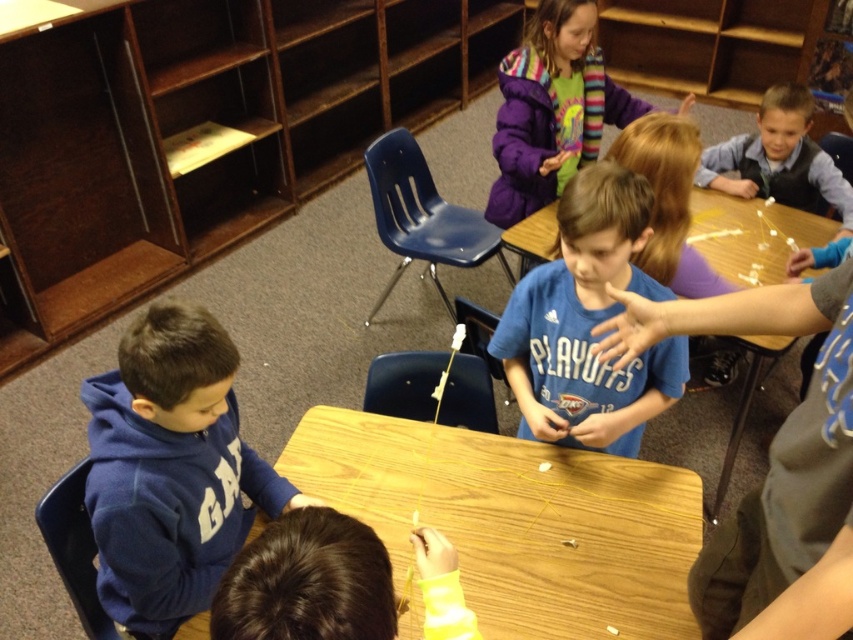
You are a child sitting at the wooden table at center and want to reach the books on the wooden bookshelf at left. Can you easily reach them without moving from your seat?

The wooden bookshelf at left is positioned over the wooden table at center, meaning it is above the table. Since you are sitting at the table, the books on the wooden bookshelf at left would be out of reach unless you stand or use a tool to retrieve them.

You are a photographer standing in front of the table. You want to take a photo of the purple fleece jacket at upper center but need to avoid capturing the dark brown hair at lower center in the frame. Based on their positions, can you position yourself in a way to achieve this?

The dark brown hair at lower center is to the left of the purple fleece jacket at upper center. By positioning yourself to the right side of the purple fleece jacket at upper center, you can avoid capturing the dark brown hair at lower center in the frame.

You are a photographer trying to capture a closeup of the blue fleece hoodie at lower left and the dark brown hair at lower center. Which object should you focus on first if you want to ensure both are in focus without moving the camera?

You should focus on the dark brown hair at lower center first because it is closer to the camera than the blue fleece hoodie at lower left, ensuring both will be in focus when using a small aperture or adjusting the focal plane.